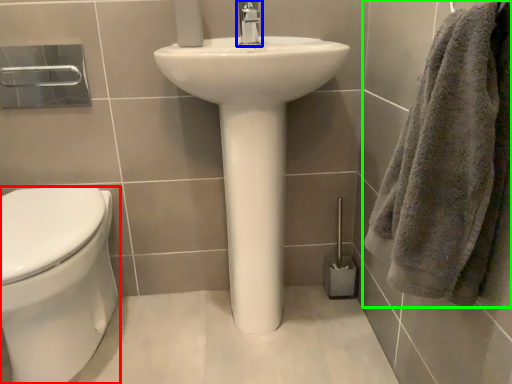
Question: Which object is positioned closest to bidet (highlighted by a red box)? Select from tap (highlighted by a blue box) and towel (highlighted by a green box).

Choices:
 (A) tap
 (B) towel

Answer: (B)